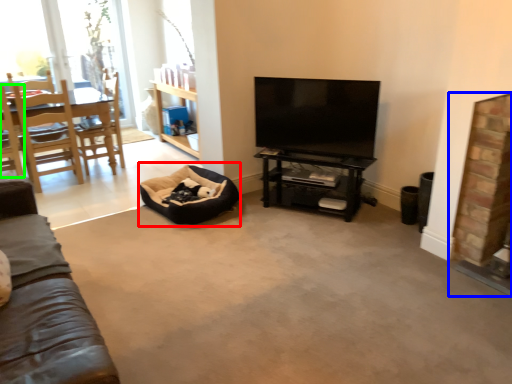
Question: Considering the real-world distances, which object is farthest from bean bag chair (highlighted by a red box)? fireplace (highlighted by a blue box) or chair (highlighted by a green box)?

Choices:
 (A) fireplace
 (B) chair

Answer: (A)